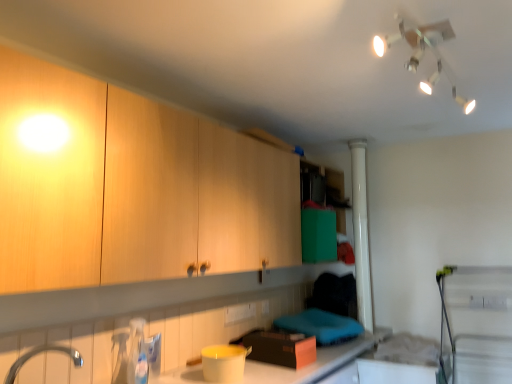
Question: Considering the positions of point (261, 370) and point (446, 64), is point (261, 370) closer or farther from the camera than point (446, 64)?

Choices:
 (A) closer
 (B) farther

Answer: (B)

Question: In terms of height, does matte plastic container at lower center look taller or shorter compared to white plastic light fixture at upper center?

Choices:
 (A) tall
 (B) short

Answer: (A)

Question: Which object is positioned closest to the silver metallic tap at lower left?

Choices:
 (A) matte plastic container at lower center
 (B) wooden cabinet at upper left
 (C) white plastic light fixture at upper center

Answer: (B)

Question: Estimate the real-world distances between objects in this image. Which object is farther from the white plastic light fixture at upper center?

Choices:
 (A) wooden cabinet at upper left
 (B) matte plastic container at lower center
 (C) silver metallic tap at lower left

Answer: (C)